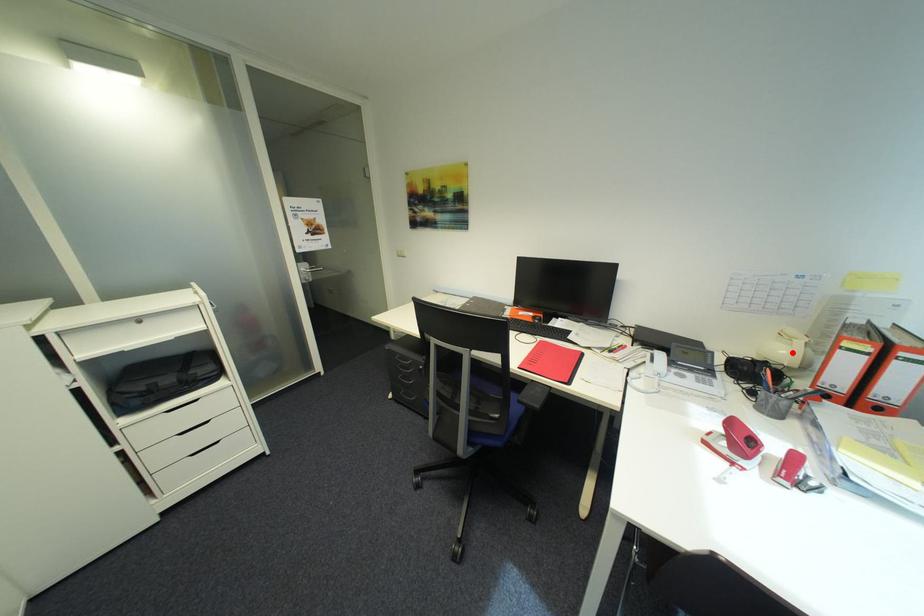
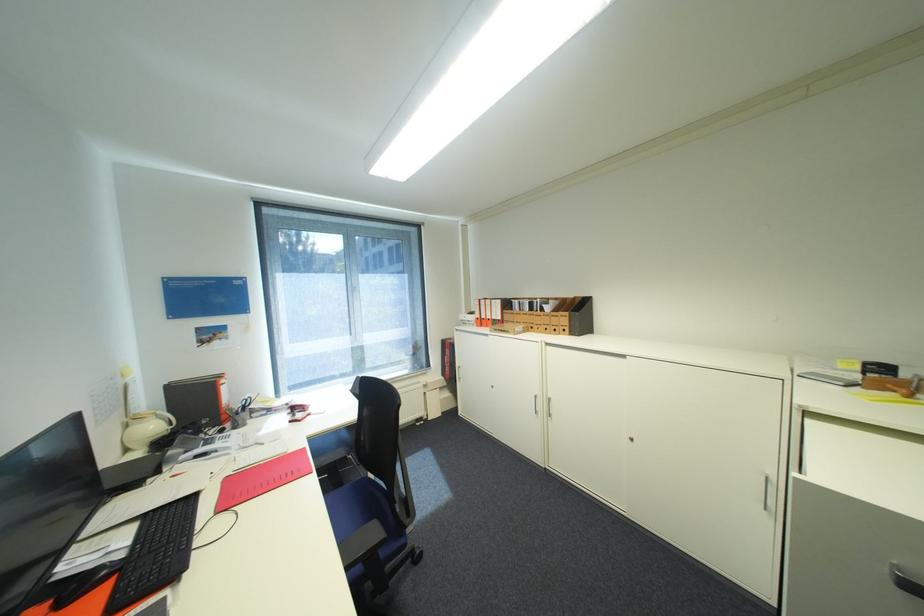
The point at the highlighted location is marked in the first image. Where is the corresponding point in the second image?

(161, 427)